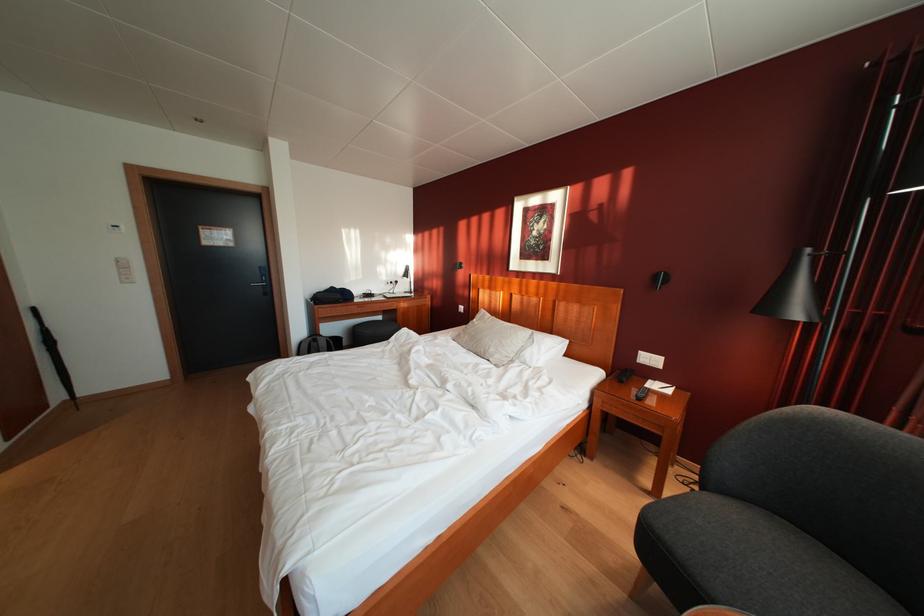
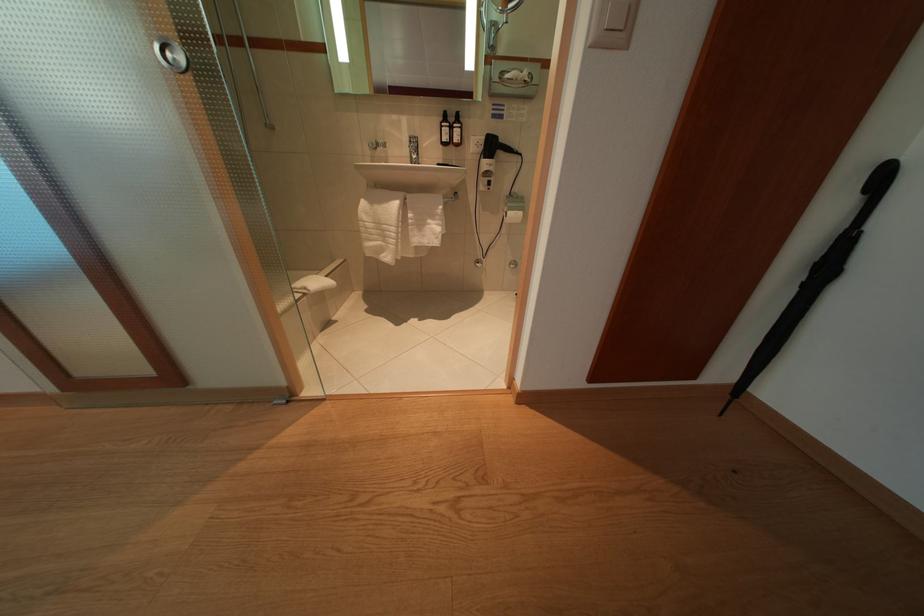
The point at (57, 349) is marked in the first image. Where is the corresponding point in the second image?

(834, 275)